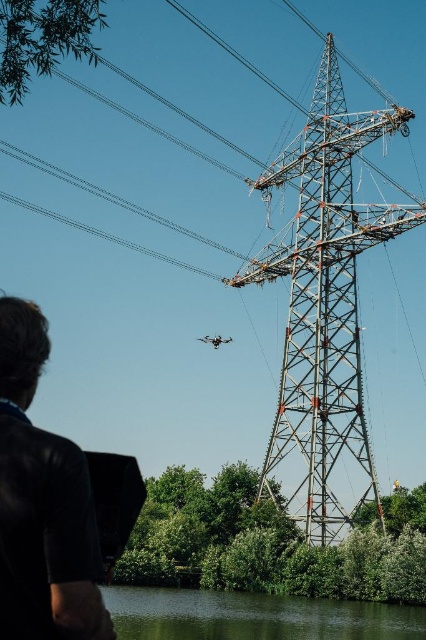
Can you confirm if metallic gray tower at center-right is positioned above green smooth water at lower center?

Correct, metallic gray tower at center-right is located above green smooth water at lower center.

Based on the photo, who is positioned more to the left, metallic gray tower at center-right or green smooth water at lower center?

green smooth water at lower center

Where is `metallic gray tower at center-right`? metallic gray tower at center-right is located at coordinates tap(325, 301).

The width and height of the screenshot is (426, 640). What are the coordinates of `metallic gray tower at center-right` in the screenshot? It's located at (325, 301).

Is metallic gray tower at center-right bigger than dark blue leather shirt at lower left?

Yes, metallic gray tower at center-right is bigger than dark blue leather shirt at lower left.

Is metallic gray tower at center-right to the right of dark blue leather shirt at lower left from the viewer's perspective?

Correct, you'll find metallic gray tower at center-right to the right of dark blue leather shirt at lower left.

What do you see at coordinates (325, 301) in the screenshot? I see `metallic gray tower at center-right` at bounding box center [325, 301].

Find the location of a particular element. metallic gray tower at center-right is located at coordinates (325, 301).

Is dark blue leather shirt at lower left closer to the viewer compared to green smooth water at lower center?

Yes, dark blue leather shirt at lower left is in front of green smooth water at lower center.

Is dark blue leather shirt at lower left taller than green smooth water at lower center?

Yes.

Is point (54, 529) positioned after point (135, 612)?

That is False.

Locate an element on the screen. The height and width of the screenshot is (640, 426). dark blue leather shirt at lower left is located at coordinates (42, 502).